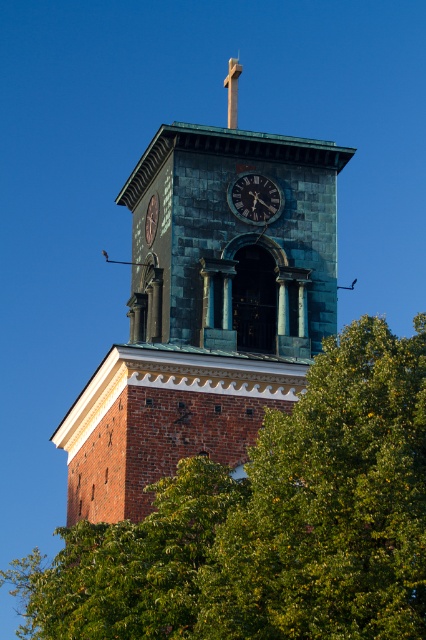
Which is more to the left, dark blue metallic clock at center or smooth gold cross at upper center?

smooth gold cross at upper center

Who is higher up, dark blue metallic clock at center or smooth gold cross at upper center?

smooth gold cross at upper center is above.

Where is `dark blue metallic clock at center`? dark blue metallic clock at center is located at coordinates (255, 198).

Can you confirm if green leafy tree at center is shorter than smooth gold cross at upper center?

No.

Does point (313, 547) come behind point (227, 83)?

No.

Is point (250, 515) less distant than point (226, 84)?

Yes, it is in front of point (226, 84).

This screenshot has height=640, width=426. Identify the location of green leafy tree at center. (267, 524).

Is green leafy tree at center smaller than dark blue metallic clock at center?

Actually, green leafy tree at center might be larger than dark blue metallic clock at center.

Looking at this image, which is above, green leafy tree at center or dark blue metallic clock at center?

dark blue metallic clock at center

At what (x,y) coordinates should I click in order to perform the action: click on green leafy tree at center. Please return your answer as a coordinate pair (x, y). This screenshot has width=426, height=640. Looking at the image, I should click on (267, 524).